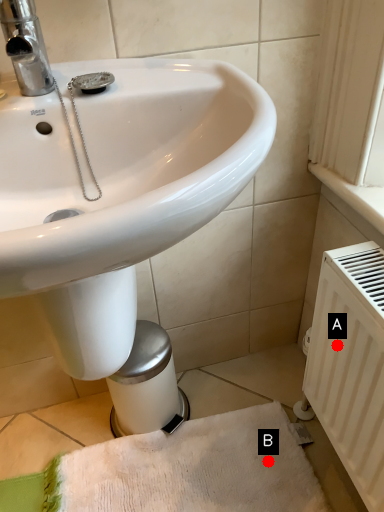
Question: Two points are circled on the image, labeled by A and B beside each circle. Which point is further to the camera?

Choices:
 (A) A is further
 (B) B is further

Answer: (B)